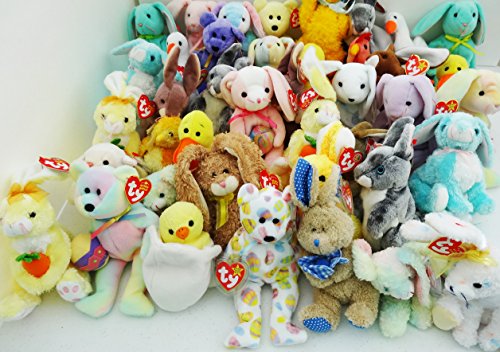
Image resolution: width=500 pixels, height=352 pixels. I want to click on bottom row of plushies, so 40,254, 119,239, 185,258, 259,255, 338,272, 394,281, 492,296.